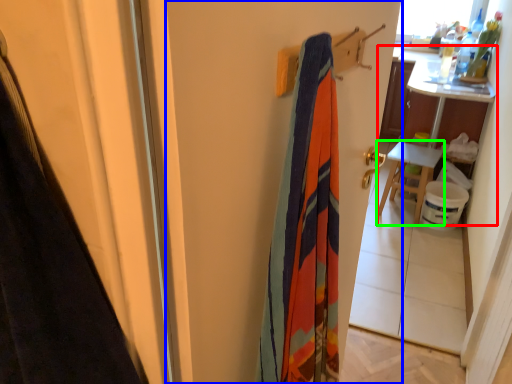
Question: Which object is the farthest from table (highlighted by a red box)? Choose among these: screen door (highlighted by a blue box) or furniture (highlighted by a green box).

Choices:
 (A) screen door
 (B) furniture

Answer: (A)